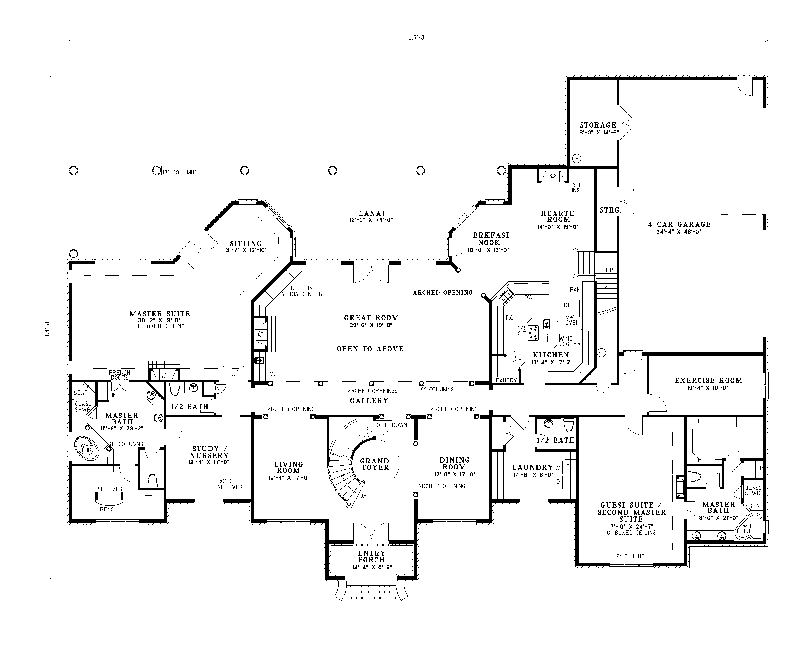
Locate an element on the screen. living room is located at coordinates (253, 419), (325, 419), (322, 517), (256, 516).